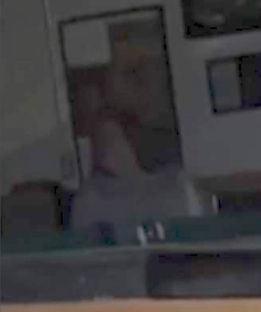
Identify the location of door. This screenshot has width=261, height=312. (136, 98).